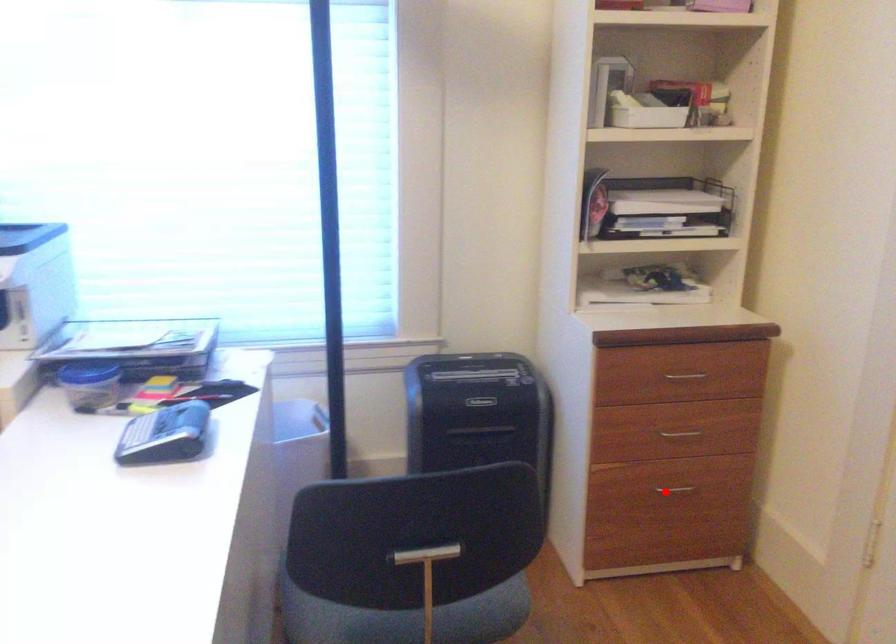
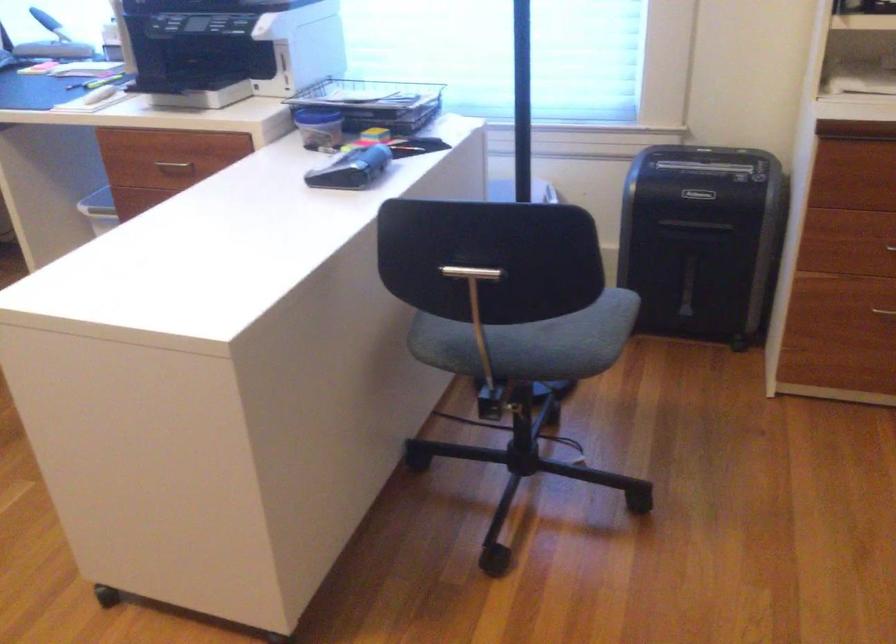
Question: A red point is marked in image1. In image2, is the corresponding 3D point closer to the camera or farther? Reply with the corresponding letter.

Choices:
 (A) The corresponding 3D point is closer.
 (B) The corresponding 3D point is farther.

Answer: (A)